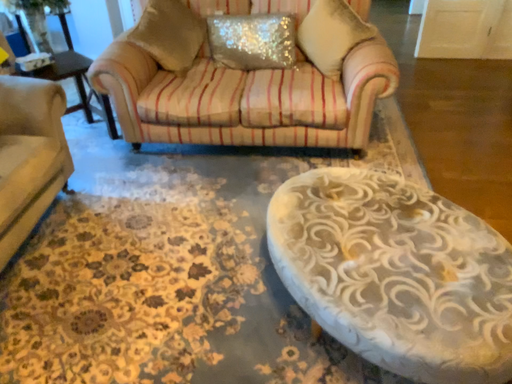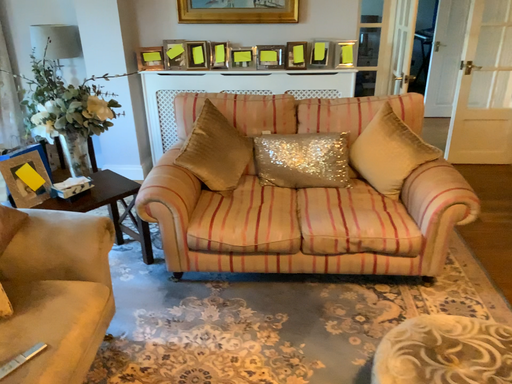
Question: Which way did the camera rotate in the video?

Choices:
 (A) rotated downward
 (B) rotated upward

Answer: (B)